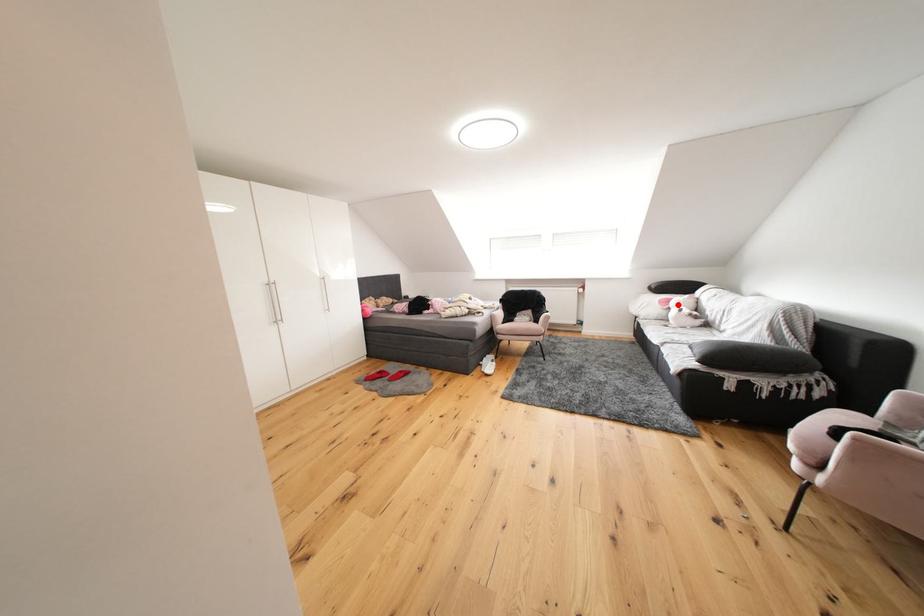
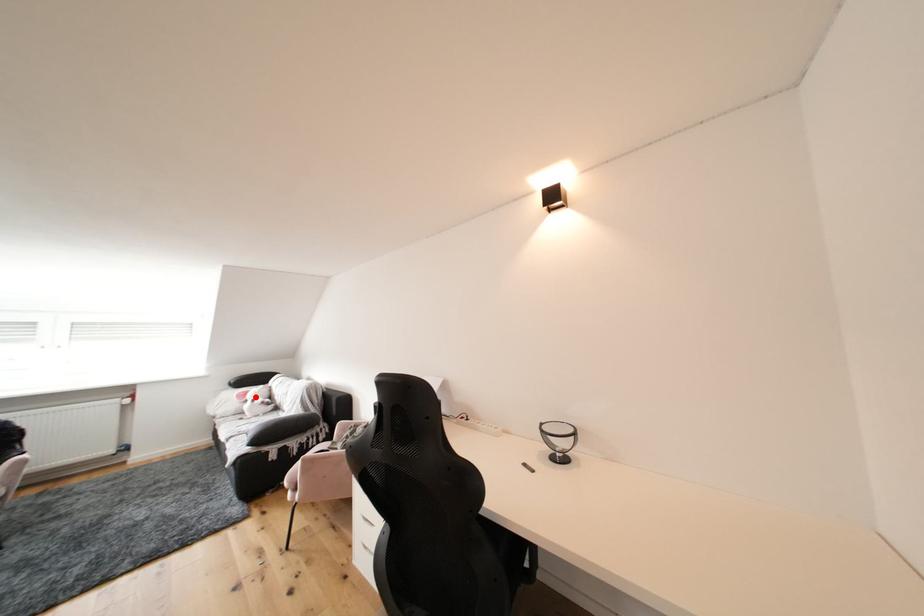
I am providing you with two images of the same scene from different viewpoints. A red point is marked on the first image and another point is marked on the second image. Is the marked point in image1 the same physical position as the marked point in image2?

Yes